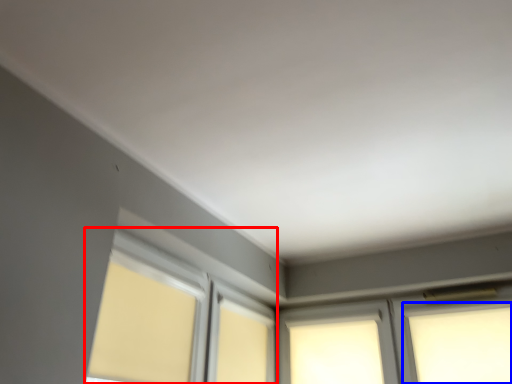
Question: Which object appears closest to the camera in this image, bay window (highlighted by a red box) or window (highlighted by a blue box)?

Choices:
 (A) bay window
 (B) window

Answer: (A)